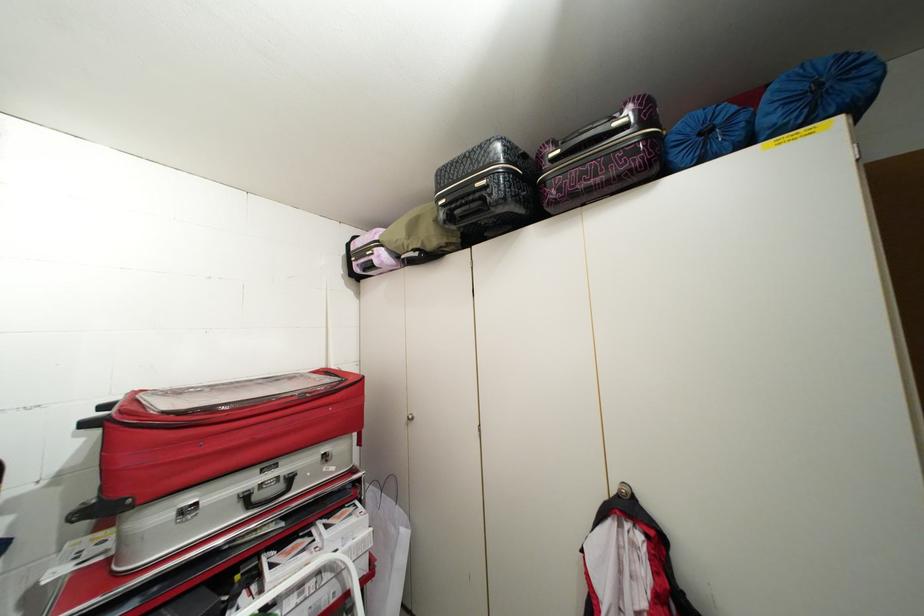
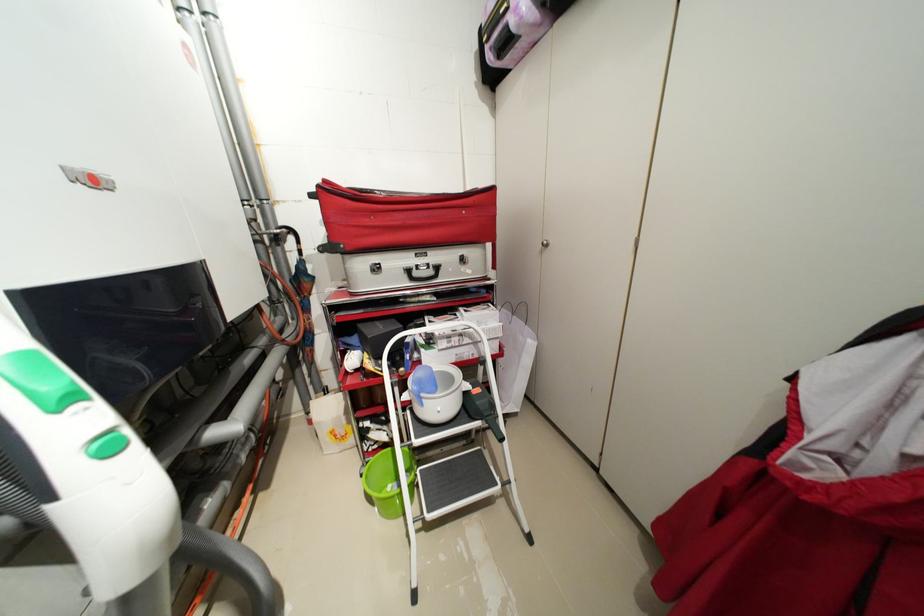
Find the pixel in the second image that matches (x=263, y=498) in the first image.

(422, 275)